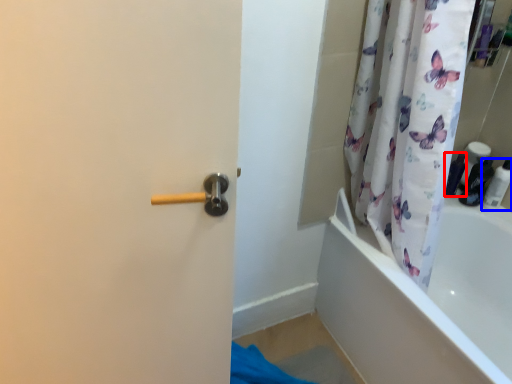
Question: Which object is further to the camera taking this photo, toiletry (highlighted by a red box) or toiletry (highlighted by a blue box)?

Choices:
 (A) toiletry
 (B) toiletry

Answer: (A)